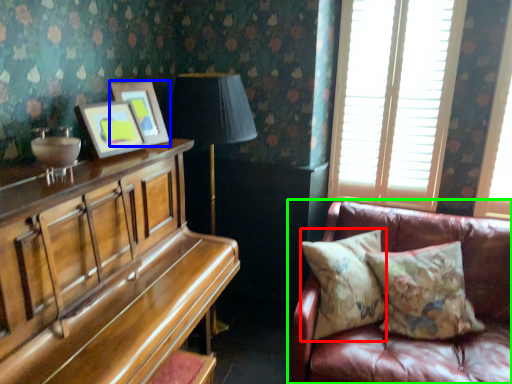
Question: Which object is positioned farthest from pillow (highlighted by a red box)? Select from picture frame (highlighted by a blue box) and studio couch (highlighted by a green box).

Choices:
 (A) picture frame
 (B) studio couch

Answer: (A)